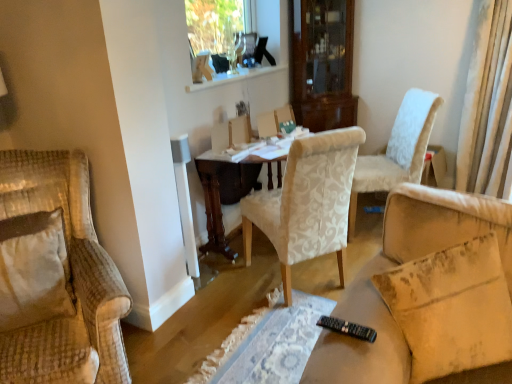
Question: Is the position of velvet beige armchair at left, acting as the first chair starting from the left, less distant than that of white textured chair at center, the second chair from the left?

Choices:
 (A) no
 (B) yes

Answer: (B)

Question: Is velvet beige armchair at left, which is the 3th chair in right-to-left order, far from white textured chair at center, the second chair when ordered from right to left?

Choices:
 (A) no
 (B) yes

Answer: (B)

Question: Is white textured chair at center, the second chair when ordered from right to left, surrounded by velvet beige armchair at left, acting as the first chair starting from the left?

Choices:
 (A) yes
 (B) no

Answer: (B)

Question: Can we say velvet beige armchair at left, acting as the first chair starting from the left, lies outside white textured chair at center, the second chair when ordered from right to left?

Choices:
 (A) no
 (B) yes

Answer: (B)

Question: From the image's perspective, does velvet beige armchair at left, acting as the first chair starting from the left, appear higher than white textured chair at center, the second chair when ordered from right to left?

Choices:
 (A) no
 (B) yes

Answer: (A)

Question: Considering the positions of white textured chair at center, positioned as the third chair in left-to-right order, and wooden table at center in the image, is white textured chair at center, positioned as the third chair in left-to-right order, wider or thinner than wooden table at center?

Choices:
 (A) thin
 (B) wide

Answer: (A)

Question: Is point (366, 155) positioned closer to the camera than point (232, 256)?

Choices:
 (A) farther
 (B) closer

Answer: (A)

Question: From the image's perspective, is white textured chair at center, marked as the first chair in a right-to-left arrangement, positioned above or below wooden table at center?

Choices:
 (A) below
 (B) above

Answer: (B)

Question: Considering the positions of white textured chair at center, positioned as the third chair in left-to-right order, and wooden table at center in the image, is white textured chair at center, positioned as the third chair in left-to-right order, bigger or smaller than wooden table at center?

Choices:
 (A) big
 (B) small

Answer: (B)

Question: From the image's perspective, relative to white textured chair at center, marked as the first chair in a right-to-left arrangement, is clear glass window frame at upper center above or below?

Choices:
 (A) above
 (B) below

Answer: (A)

Question: From a real-world perspective, is clear glass window frame at upper center above or below white textured chair at center, marked as the first chair in a right-to-left arrangement?

Choices:
 (A) below
 (B) above

Answer: (B)

Question: Is clear glass window frame at upper center to the left or to the right of white textured chair at center, positioned as the third chair in left-to-right order, in the image?

Choices:
 (A) left
 (B) right

Answer: (A)

Question: Considering the positions of clear glass window frame at upper center and white textured chair at center, marked as the first chair in a right-to-left arrangement, in the image, is clear glass window frame at upper center wider or thinner than white textured chair at center, marked as the first chair in a right-to-left arrangement,?

Choices:
 (A) wide
 (B) thin

Answer: (B)

Question: Considering the positions of point (468, 319) and point (357, 162), is point (468, 319) closer or farther from the camera than point (357, 162)?

Choices:
 (A) closer
 (B) farther

Answer: (A)

Question: Is beige fabric pillow at lower right bigger or smaller than white textured chair at center, marked as the first chair in a right-to-left arrangement?

Choices:
 (A) small
 (B) big

Answer: (A)